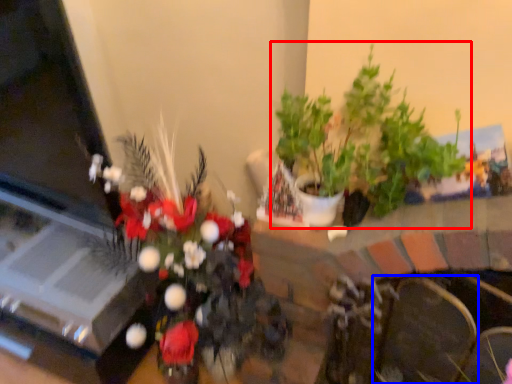
Question: Which object is closer to the camera taking this photo, houseplant (highlighted by a red box) or armchair (highlighted by a blue box)?

Choices:
 (A) houseplant
 (B) armchair

Answer: (A)